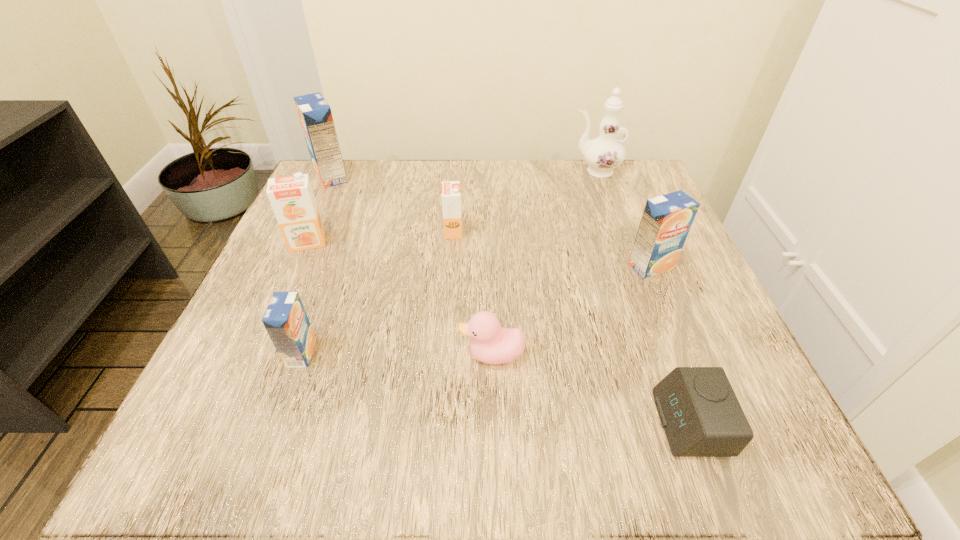
Where is `duckling`? Image resolution: width=960 pixels, height=540 pixels. duckling is located at coordinates (492, 344).

Where is `the fifth object from left to right`? the fifth object from left to right is located at coordinates (492, 344).

The height and width of the screenshot is (540, 960). I want to click on black alarm clock, so click(x=701, y=416).

I want to click on the nearest object, so click(701, 416).

Locate an element on the screen. The width and height of the screenshot is (960, 540). free region located 0.370m at the spout of the chinaware is located at coordinates (416, 171).

Image resolution: width=960 pixels, height=540 pixels. What are the coordinates of `free point located 0.270m at the spout of the chinaware` in the screenshot? It's located at (457, 171).

The image size is (960, 540). I want to click on vacant space located at the spout of the chinaware, so click(x=544, y=171).

Locate an element on the screen. vacant space situated 0.310m on the right of the tallest orange juice is located at coordinates point(481,177).

This screenshot has width=960, height=540. What are the coordinates of `free region located 0.240m on the front of the left orange orange juice` in the screenshot? It's located at (258, 355).

This screenshot has height=540, width=960. Identify the location of blank space located on the back of the second biggest blue orange_juice. (614, 177).